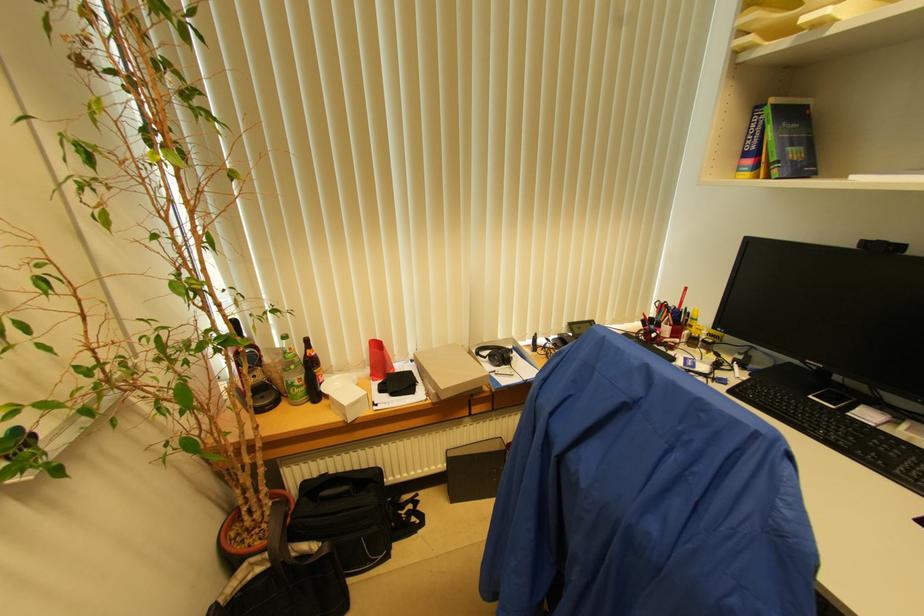
Where is `black bag strap`? The width and height of the screenshot is (924, 616). black bag strap is located at coordinates (277, 535).